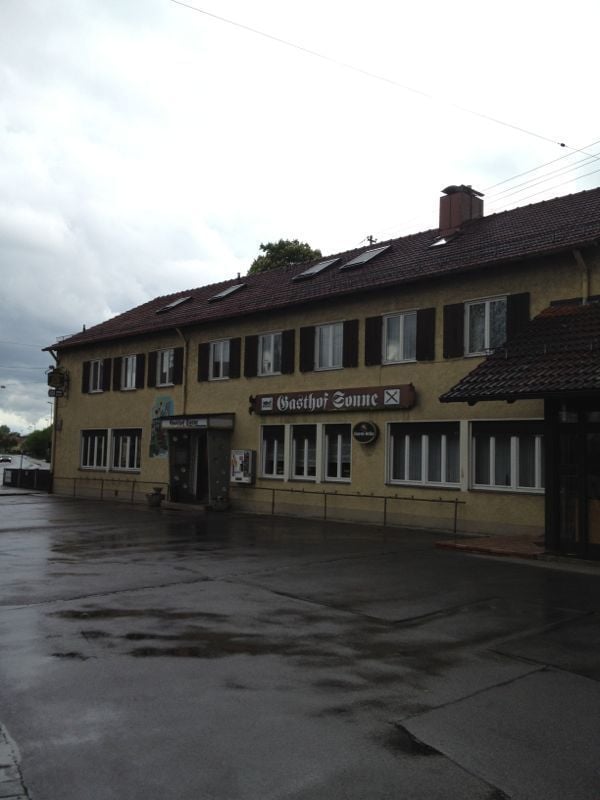
Locate an element on the screen. chimney is located at coordinates (460, 202).